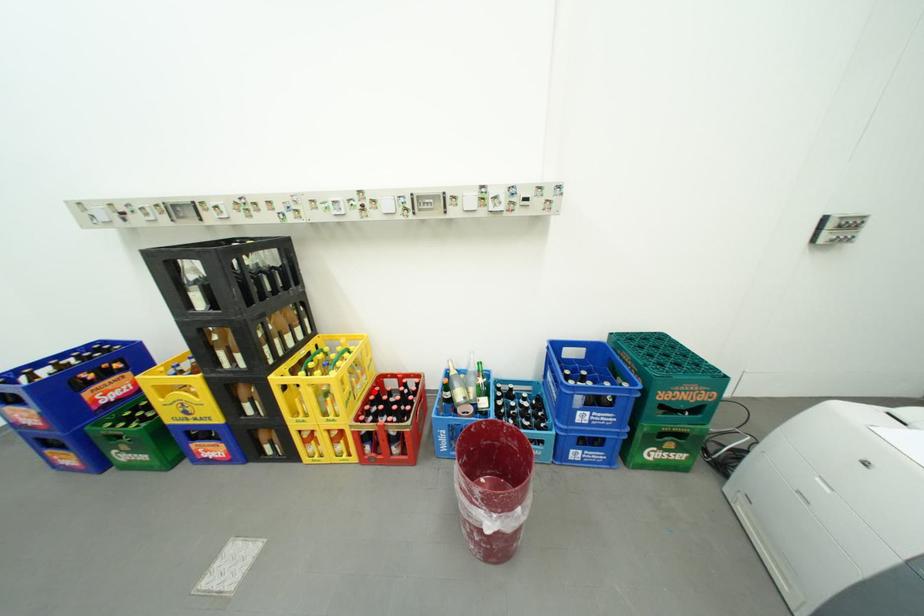
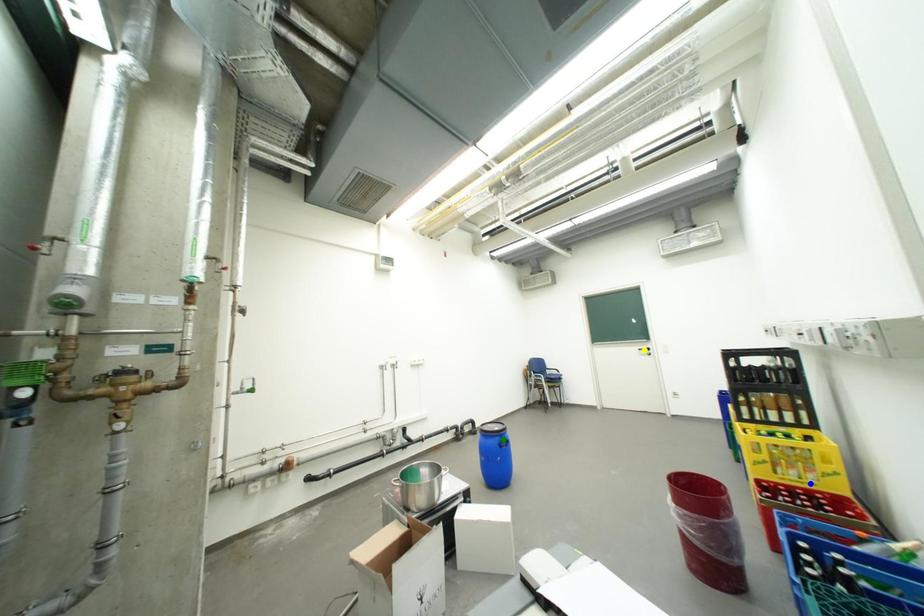
Question: I am providing you with two images of the same scene from different viewpoints. A red point is marked on the first image. You are given multiple points on the second image. Which mark in image 2 goes with the point in image 1?

Choices:
 (A) yellow point
 (B) blue point
 (C) green point

Answer: (B)